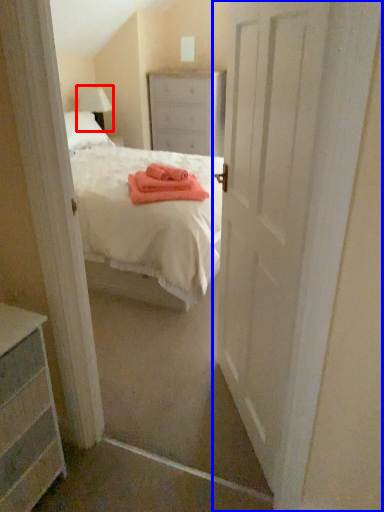
Question: Which point is closer to the camera, lamp (highlighted by a red box) or door (highlighted by a blue box)?

Choices:
 (A) lamp
 (B) door

Answer: (B)